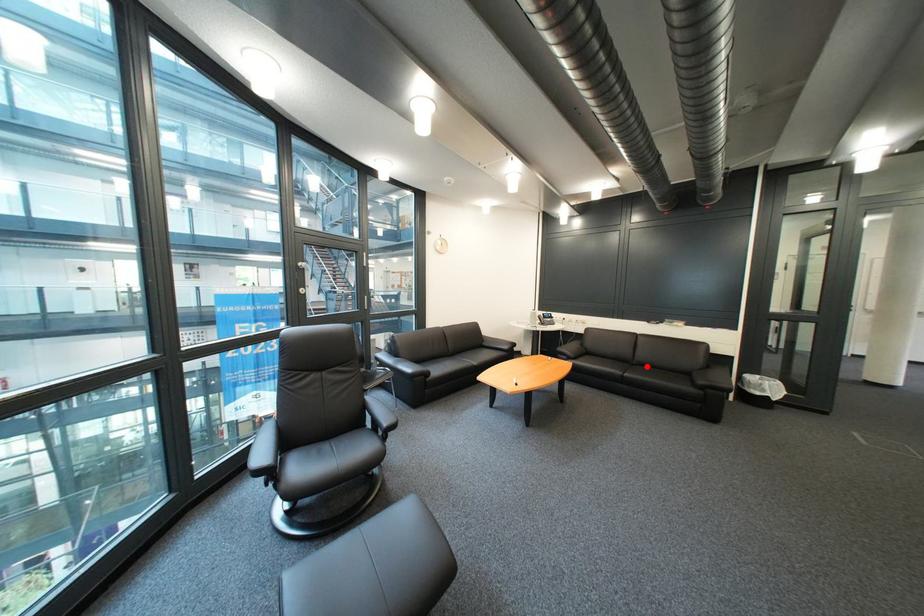
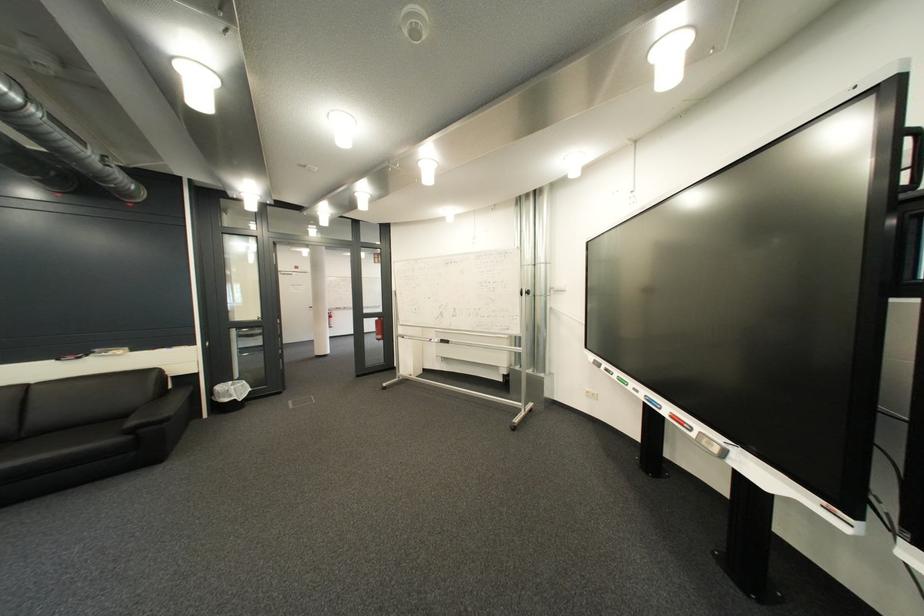
Question: I am providing you with two images of the same scene from different viewpoints. A red point is marked on the first image. Can you still see the location of the red point in image 2?

Choices:
 (A) Yes
 (B) No

Answer: (A)